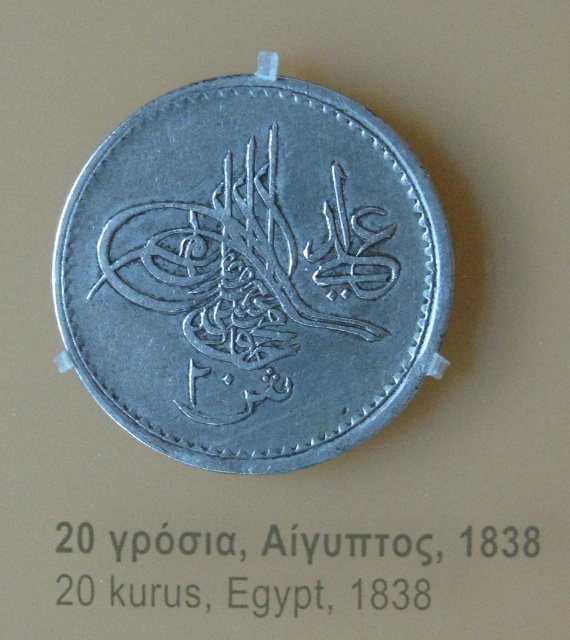
From the picture: Can you confirm if silver metallic coin at center is positioned below black metallic text at center?

Actually, silver metallic coin at center is above black metallic text at center.

Which is more to the right, silver metallic coin at center or black metallic text at center?

black metallic text at center is more to the right.

Find the location of a particular element. The width and height of the screenshot is (570, 640). silver metallic coin at center is located at coordinates (251, 273).